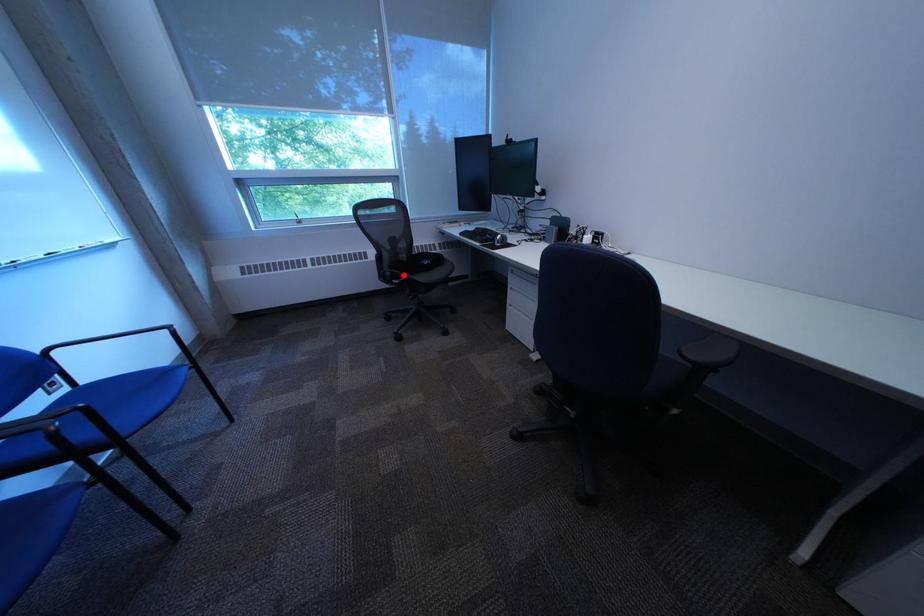
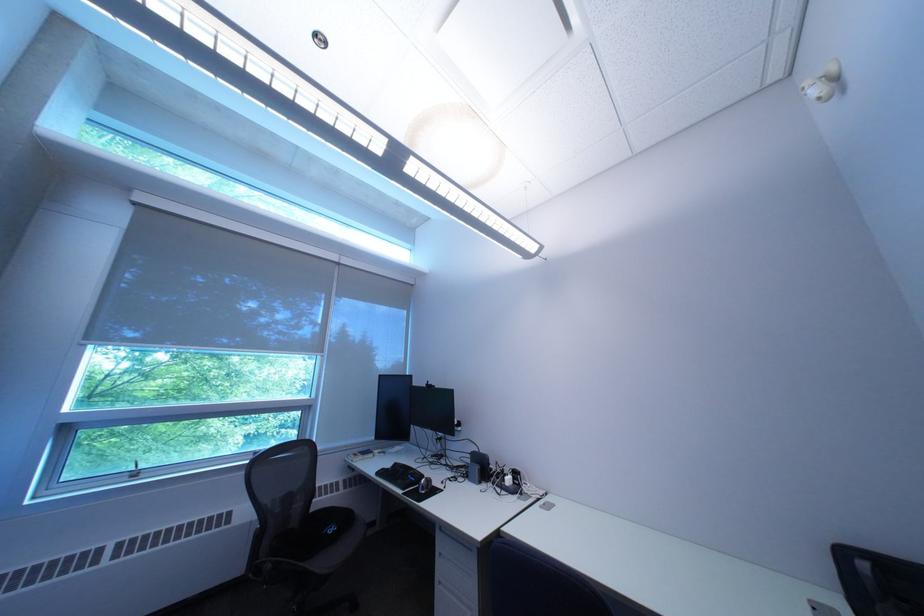
In the second image, find the point that corresponds to the highlighted location in the first image.

(285, 568)